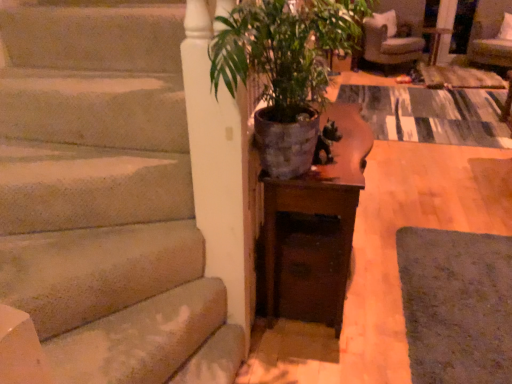
Image resolution: width=512 pixels, height=384 pixels. Identify the location of velvet beige armchair at upper right. (489, 40).

This screenshot has width=512, height=384. I want to click on green matte pot at center, so click(284, 70).

Where is `beige fabric armchair at upper right`? This screenshot has height=384, width=512. beige fabric armchair at upper right is located at coordinates (391, 41).

You are a GUI agent. You are given a task and a screenshot of the screen. Output one action in this format:
    pyautogui.click(x=<x>, y=<y>)
    Task: Click on the wooden table at center
    This screenshot has width=512, height=384.
    Given the screenshot: What is the action you would take?
    pyautogui.click(x=323, y=196)

This screenshot has width=512, height=384. Find the location of `velvet beige armchair at upper right`. velvet beige armchair at upper right is located at coordinates (489, 40).

Does wooden table at center come in front of green matte pot at center?

No, the depth of wooden table at center is greater than that of green matte pot at center.

From a real-world perspective, which object stands above the other?

green matte pot at center.

Considering the sizes of wooden table at center and green matte pot at center in the image, is wooden table at center wider or thinner than green matte pot at center?

Considering their sizes, wooden table at center looks slimmer than green matte pot at center.

Considering the sizes of wooden table at center and green matte pot at center in the image, is wooden table at center taller or shorter than green matte pot at center?

Considering their sizes, wooden table at center has more height than green matte pot at center.

Based on the photo, considering the relative sizes of velvet beige armchair at upper right and green matte pot at center in the image provided, is velvet beige armchair at upper right shorter than green matte pot at center?

Incorrect, the height of velvet beige armchair at upper right does not fall short of that of green matte pot at center.

This screenshot has width=512, height=384. What are the coordinates of `armchair below the green matte pot at center (from a real-world perspective)` in the screenshot? It's located at (489, 40).

Which is behind, velvet beige armchair at upper right or green matte pot at center?

velvet beige armchair at upper right is further from the camera.

Is velvet beige armchair at upper right situated inside green matte pot at center or outside?

velvet beige armchair at upper right is outside green matte pot at center.

Based on the photo, between wooden table at center and beige fabric armchair at upper right, which one has less height?

Standing shorter between the two is beige fabric armchair at upper right.

Is wooden table at center beside beige fabric armchair at upper right?

wooden table at center is not next to beige fabric armchair at upper right, and they're not touching.

Which is closer, [300,200] or [407,24]?

The point [300,200] is in front.

From the image's perspective, is wooden table at center on top of beige fabric armchair at upper right?

Actually, wooden table at center appears below beige fabric armchair at upper right in the image.

Could you tell me if wooden side table at center is turned towards green matte pot at center?

Yes, wooden side table at center is facing green matte pot at center.

Is wooden side table at center next to green matte pot at center?

wooden side table at center is not next to green matte pot at center, and they're not touching.

Between point (425, 30) and point (292, 46), which one is positioned behind?

The point (425, 30) is farther from the camera.

Does wooden side table at center have a larger size compared to green matte pot at center?

Actually, wooden side table at center might be smaller than green matte pot at center.

Who is smaller, wooden table at center or wooden side table at center?

With smaller size is wooden side table at center.

Between wooden table at center and wooden side table at center, which one has larger width?

wooden side table at center.

Based on their positions, is wooden table at center located to the left or right of wooden side table at center?

wooden table at center is positioned on wooden side table at center's left side.

From the image's perspective, is wooden table at center below wooden side table at center?

Yes, from the image's perspective, wooden table at center is beneath wooden side table at center.

From a real-world perspective, is velvet beige armchair at upper right physically located above or below wooden table at center?

velvet beige armchair at upper right is above wooden table at center.

Is velvet beige armchair at upper right not within wooden table at center?

Indeed, velvet beige armchair at upper right is completely outside wooden table at center.

Does velvet beige armchair at upper right have a lesser height compared to wooden table at center?

Indeed, velvet beige armchair at upper right has a lesser height compared to wooden table at center.

Which point is more distant from viewer, (493,35) or (347,228)?

The point (493,35) is behind.

Are wooden table at center and velvet beige armchair at upper right beside each other?

No, wooden table at center is not next to velvet beige armchair at upper right.

Does wooden table at center lie behind velvet beige armchair at upper right?

No, wooden table at center is in front of velvet beige armchair at upper right.

Is wooden table at center oriented towards velvet beige armchair at upper right?

No, wooden table at center does not turn towards velvet beige armchair at upper right.

Considering the relative positions of wooden table at center and velvet beige armchair at upper right in the image provided, is wooden table at center to the right of velvet beige armchair at upper right from the viewer's perspective?

No, wooden table at center is not to the right of velvet beige armchair at upper right.

You are a GUI agent. You are given a task and a screenshot of the screen. Output one action in this format:
    pyautogui.click(x=<x>, y=<y>)
    Task: Click on the houseplant in front of the wooden table at center
    This screenshot has width=512, height=384.
    Given the screenshot: What is the action you would take?
    pyautogui.click(x=284, y=70)

At what (x,y) coordinates should I click in order to perform the action: click on armchair above the green matte pot at center (from the image's perspective). Please return your answer as a coordinate pair (x, y). The height and width of the screenshot is (384, 512). Looking at the image, I should click on (489, 40).

From the image, which object appears to be farther from beige fabric armchair at upper right, velvet beige armchair at upper right or wooden table at center?

wooden table at center is positioned further to the anchor beige fabric armchair at upper right.

When comparing their distances from beige fabric armchair at upper right, does wooden table at center or velvet beige armchair at upper right seem further?

Based on the image, wooden table at center appears to be further to beige fabric armchair at upper right.

When comparing their distances from green matte pot at center, does wooden table at center or wooden side table at center seem closer?

wooden table at center lies closer to green matte pot at center than the other object.

In the scene shown: Based on their spatial positions, is wooden side table at center or wooden table at center further from beige fabric armchair at upper right?

wooden table at center lies further to beige fabric armchair at upper right than the other object.

When comparing their distances from green matte pot at center, does wooden side table at center or wooden table at center seem closer?

Among the two, wooden table at center is located nearer to green matte pot at center.

When comparing their distances from wooden side table at center, does velvet beige armchair at upper right or green matte pot at center seem further?

green matte pot at center is positioned further to the anchor wooden side table at center.

Based on their spatial positions, is green matte pot at center or wooden table at center further from beige fabric armchair at upper right?

Based on the image, green matte pot at center appears to be further to beige fabric armchair at upper right.

Estimate the real-world distances between objects in this image. Which object is further from velvet beige armchair at upper right, beige fabric armchair at upper right or green matte pot at center?

Among the two, green matte pot at center is located further to velvet beige armchair at upper right.

Where is `side table between beige fabric armchair at upper right and velvet beige armchair at upper right from left to right`? The height and width of the screenshot is (384, 512). side table between beige fabric armchair at upper right and velvet beige armchair at upper right from left to right is located at coordinates (435, 41).

This screenshot has height=384, width=512. Identify the location of armchair between wooden table at center and wooden side table at center along the z-axis. (489, 40).

Where is `chair positioned between green matte pot at center and wooden side table at center from near to far`? The width and height of the screenshot is (512, 384). chair positioned between green matte pot at center and wooden side table at center from near to far is located at coordinates (391, 41).

Identify the location of table located between green matte pot at center and velvet beige armchair at upper right in the depth direction. The image size is (512, 384). (323, 196).